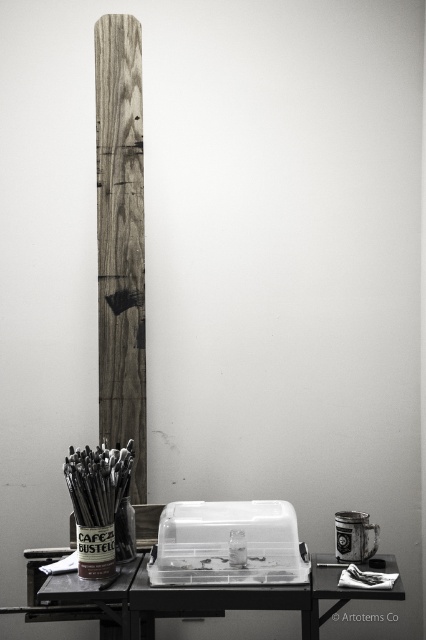
Question: Which point is closer to the camera?

Choices:
 (A) black plastic table at lower center
 (B) wooden plank at left

Answer: (A)

Question: Is wooden plank at left closer to the viewer compared to black plastic table at lower center?

Choices:
 (A) no
 (B) yes

Answer: (A)

Question: Is wooden plank at left bigger than black plastic table at lower center?

Choices:
 (A) yes
 (B) no

Answer: (B)

Question: Which point is closer to the camera?

Choices:
 (A) (111, 227)
 (B) (386, 554)

Answer: (B)

Question: Does wooden plank at left have a smaller size compared to black plastic table at lower center?

Choices:
 (A) yes
 (B) no

Answer: (A)